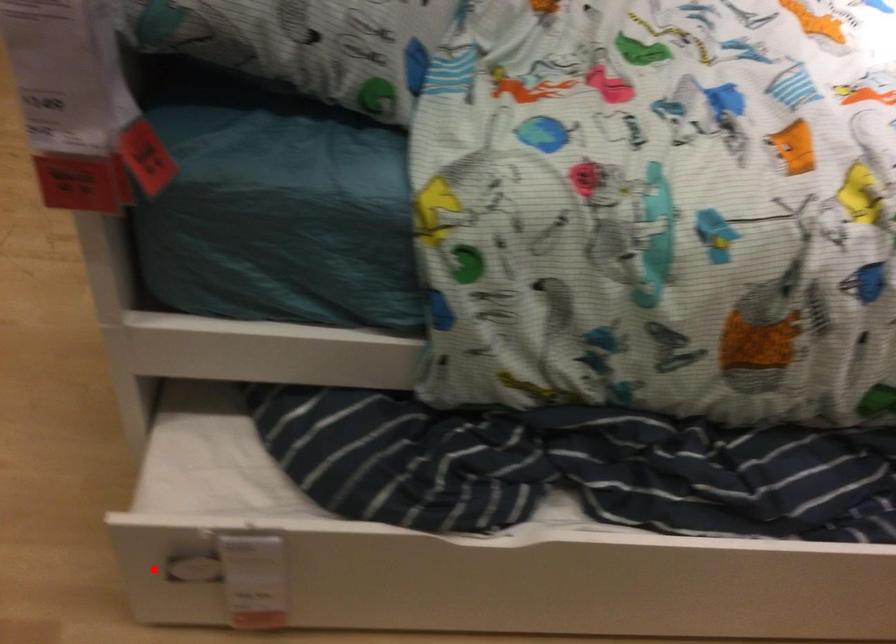
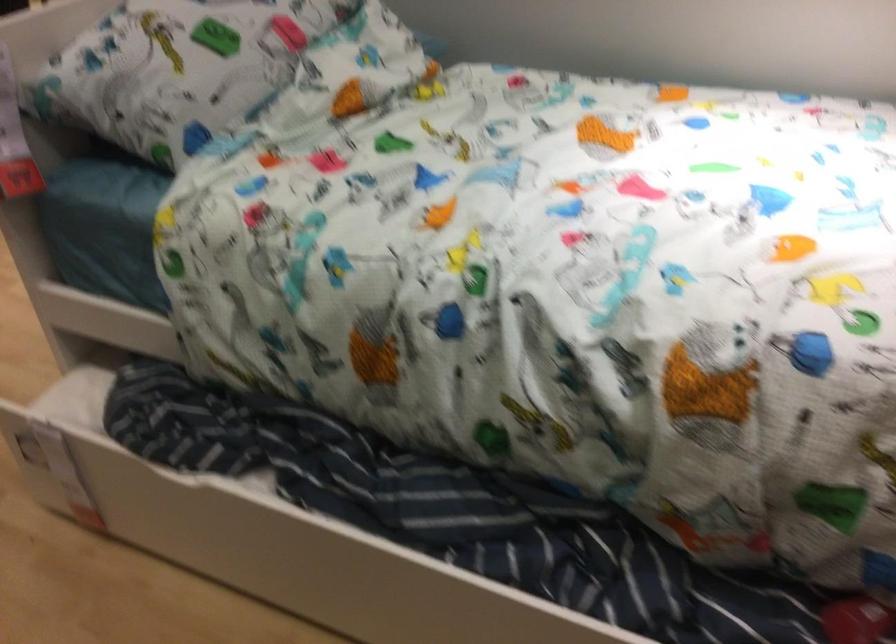
The point at the highlighted location is marked in the first image. Where is the corresponding point in the second image?

(24, 448)